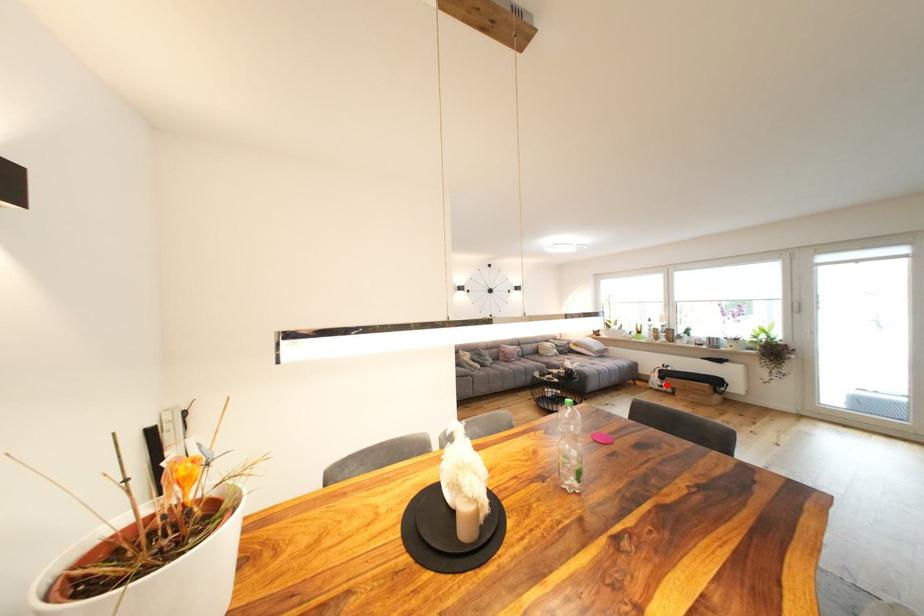
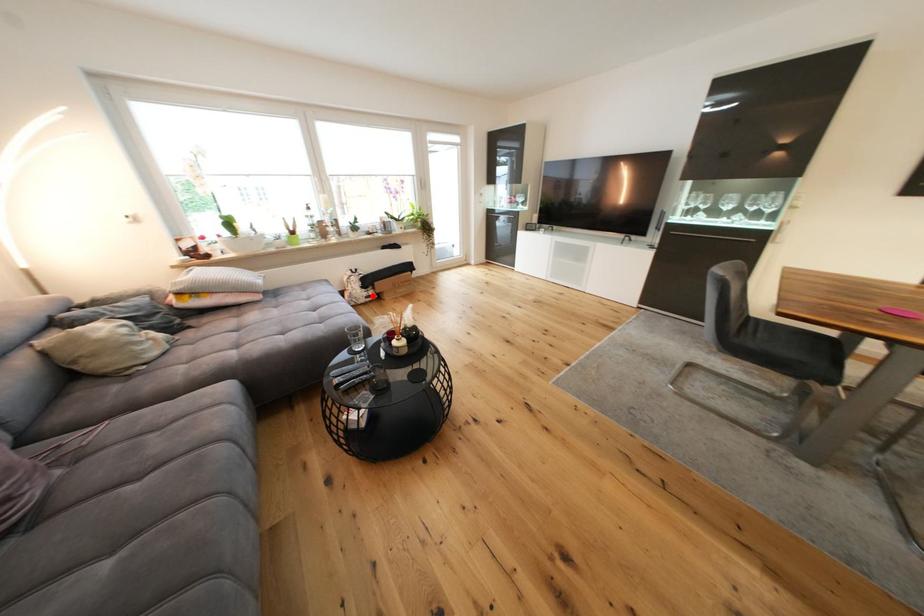
I am providing you with two images of the same scene from different viewpoints. A red point is marked on the first image and another point is marked on the second image. Are the points marked in image1 and image2 representing the same 3D position?

Yes